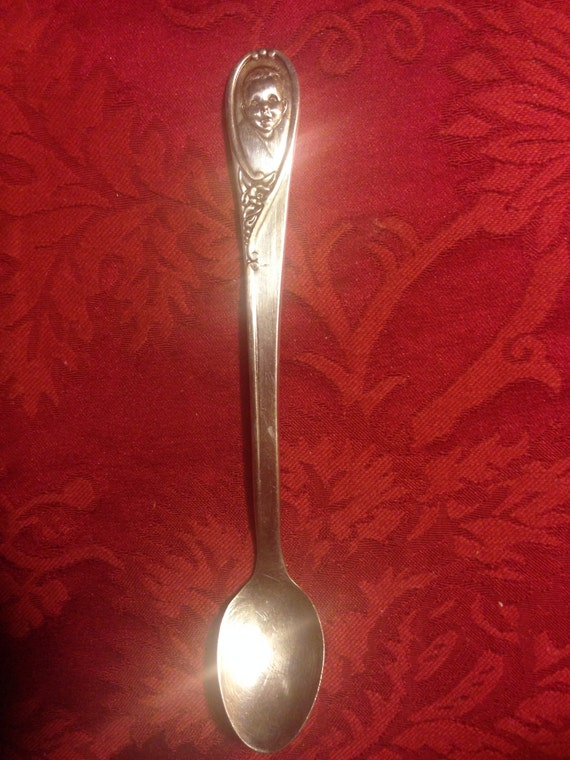
Find the location of a particular element. leaf design on table cloth is located at coordinates (72, 252), (364, 483), (525, 144).